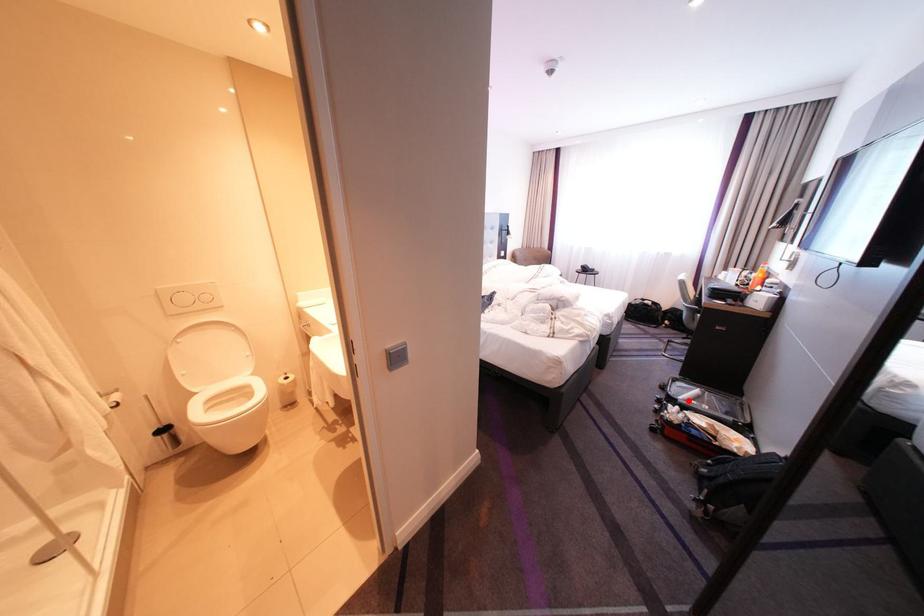
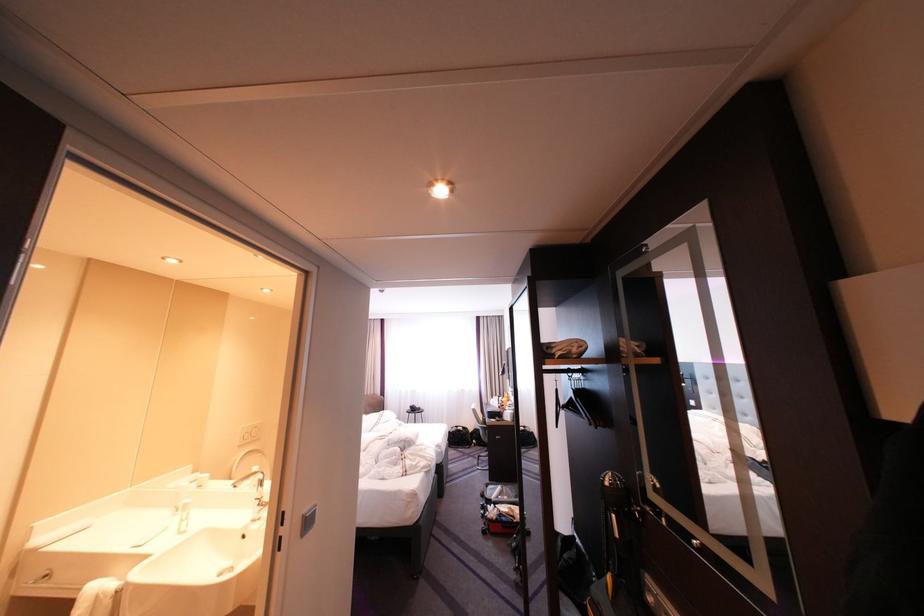
Find the pixel in the second image that matches the highlighted location in the first image.

(503, 501)